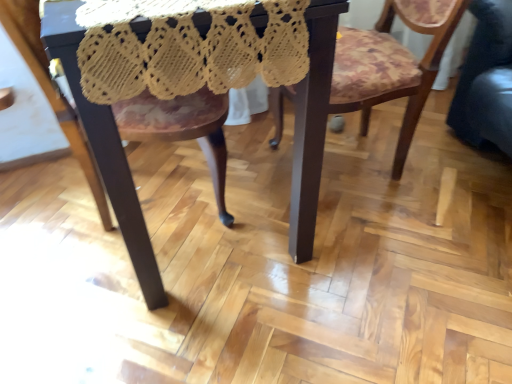
The image size is (512, 384). Identify the location of vacant space underneath dark brown polished wood table at center (from a real-world perspective). (225, 198).